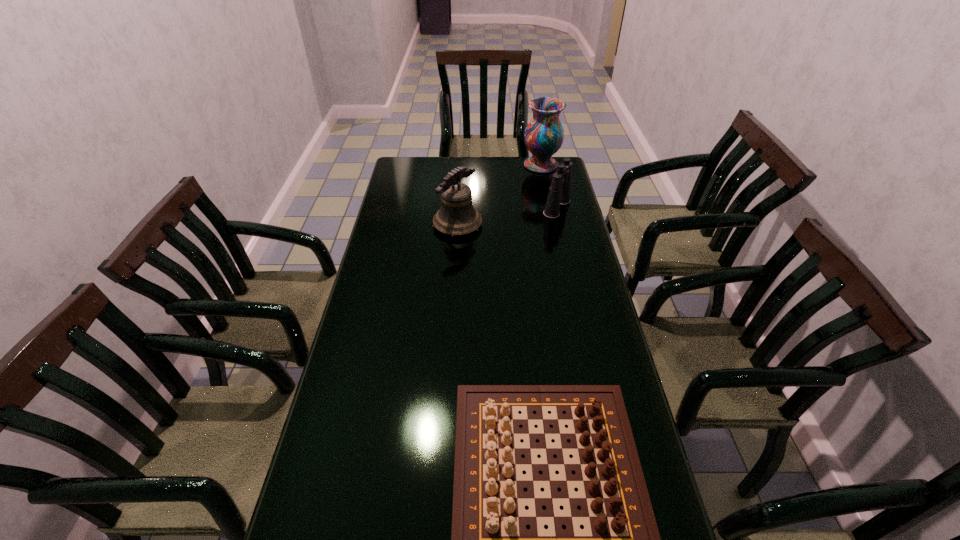
At what (x,y) coordinates should I click in order to perform the action: click on vase. Please return your answer as a coordinate pair (x, y). The width and height of the screenshot is (960, 540). Looking at the image, I should click on (544, 134).

At what (x,y) coordinates should I click in order to perform the action: click on the tallest object. Please return your answer as a coordinate pair (x, y). This screenshot has height=540, width=960. Looking at the image, I should click on (544, 134).

Where is `bell`? bell is located at coordinates (457, 216).

Identify the location of binoculars. (559, 192).

At what (x,y) coordinates should I click in order to perform the action: click on free spot located on the left of the vase. Please return your answer as a coordinate pair (x, y). Looking at the image, I should click on (484, 165).

Locate an element on the screen. The height and width of the screenshot is (540, 960). free space located on the back of the bell is located at coordinates (460, 183).

Locate an element on the screen. The height and width of the screenshot is (540, 960). vacant space located on the left of the binoculars is located at coordinates (495, 208).

You are a GUI agent. You are given a task and a screenshot of the screen. Output one action in this format:
    pyautogui.click(x=<x>, y=<y>)
    Task: Click on the object situated at the far edge
    The image size is (960, 540).
    Given the screenshot: What is the action you would take?
    pyautogui.click(x=544, y=134)

Identify the location of vase that is at the right edge. (544, 134).

Find the location of a particular element. binoculars that is at the right edge is located at coordinates (559, 192).